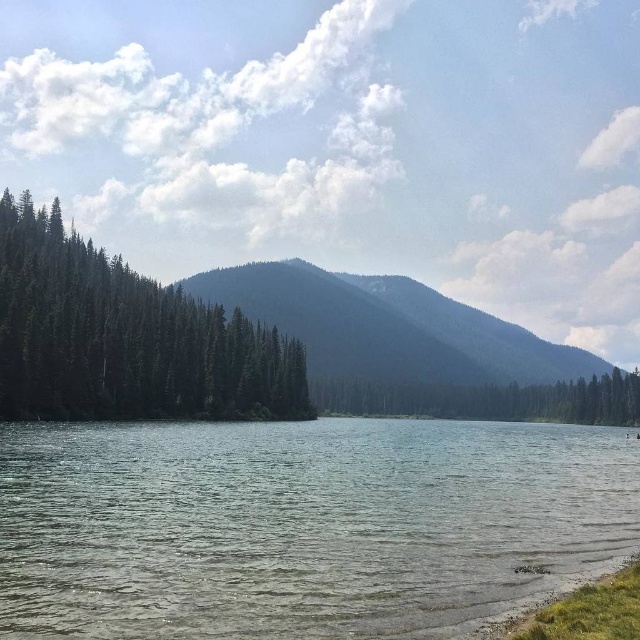
Question: Does clear water at lower center have a smaller size compared to green matte trees at left?

Choices:
 (A) no
 (B) yes

Answer: (B)

Question: Is green matte trees at left thinner than green textured mountain at center?

Choices:
 (A) no
 (B) yes

Answer: (B)

Question: Is green textured mountain at center below green matte tree at center?

Choices:
 (A) no
 (B) yes

Answer: (A)

Question: Which object is positioned closest to the green matte tree at center?

Choices:
 (A) clear water at lower center
 (B) green matte trees at left
 (C) green textured mountain at center

Answer: (C)

Question: Which object appears farthest from the camera in this image?

Choices:
 (A) clear water at lower center
 (B) green matte trees at left

Answer: (B)

Question: Which point is farther from the camera taking this photo?

Choices:
 (A) (522, 488)
 (B) (273, 355)

Answer: (B)